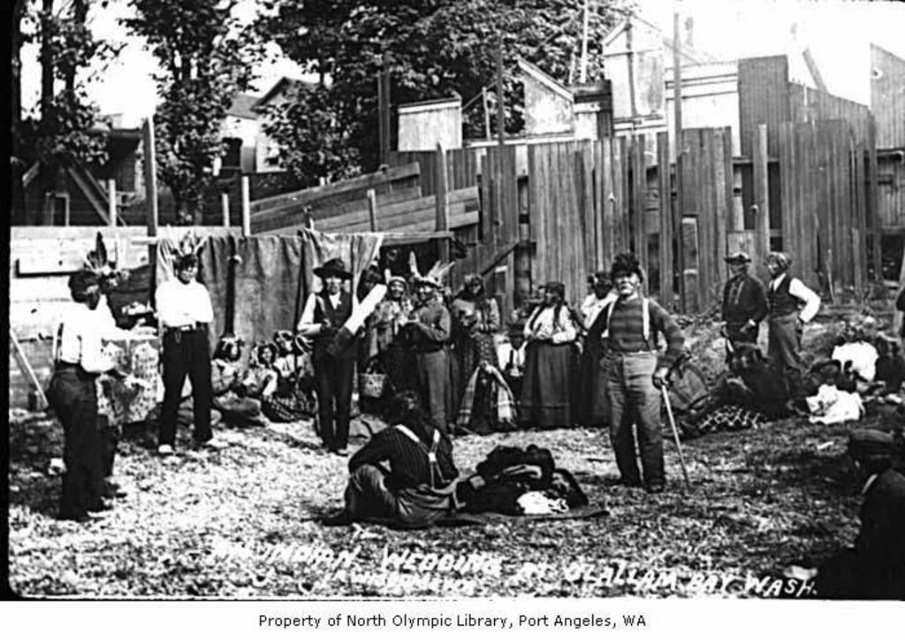
Question: Can you confirm if white cotton blouse at left is positioned to the right of smooth leather vest at center?

Choices:
 (A) yes
 (B) no

Answer: (B)

Question: Estimate the real-world distances between objects in this image. Which object is closer to the white cotton blouse at left?

Choices:
 (A) striped fabric pants at center
 (B) striped cotton shirt at center

Answer: (A)

Question: Can you confirm if dark brown leather hat at lower right is wider than smooth leather vest at center?

Choices:
 (A) no
 (B) yes

Answer: (B)

Question: Which point is closer to the camera?

Choices:
 (A) (459, 307)
 (B) (74, 394)

Answer: (B)

Question: Is striped cotton shirt at center positioned before white cotton blouse at left?

Choices:
 (A) no
 (B) yes

Answer: (A)

Question: Which of these objects is positioned closest to the matte brown dress at center?

Choices:
 (A) white cotton blouse at left
 (B) striped cotton shirt at center
 (C) leather jacket at center

Answer: (C)